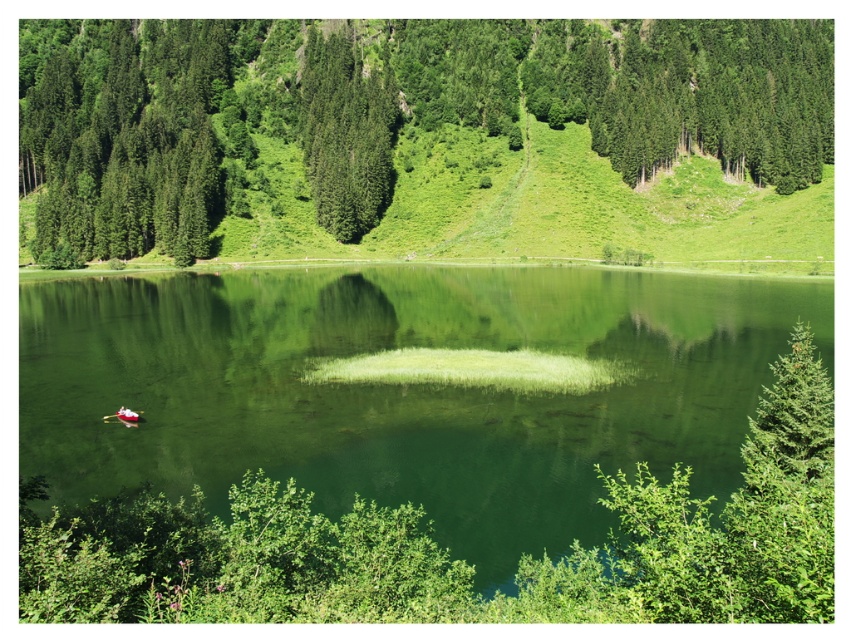
Question: Which object appears farthest from the camera in this image?

Choices:
 (A) green smooth water at center
 (B) green matte tree at center

Answer: (B)

Question: Observing the image, what is the correct spatial positioning of green smooth water at center in reference to green matte tree at center?

Choices:
 (A) right
 (B) left

Answer: (B)

Question: Based on their relative distances, which object is nearer to the green matte tree at center?

Choices:
 (A) green textured tree at upper center
 (B) green smooth water at center

Answer: (A)

Question: Does green smooth water at center have a smaller size compared to green matte tree at center?

Choices:
 (A) no
 (B) yes

Answer: (B)

Question: Which point is closer to the camera?

Choices:
 (A) (347, 163)
 (B) (614, 113)

Answer: (A)

Question: Is green smooth water at center further to the viewer compared to green matte tree at center?

Choices:
 (A) no
 (B) yes

Answer: (A)